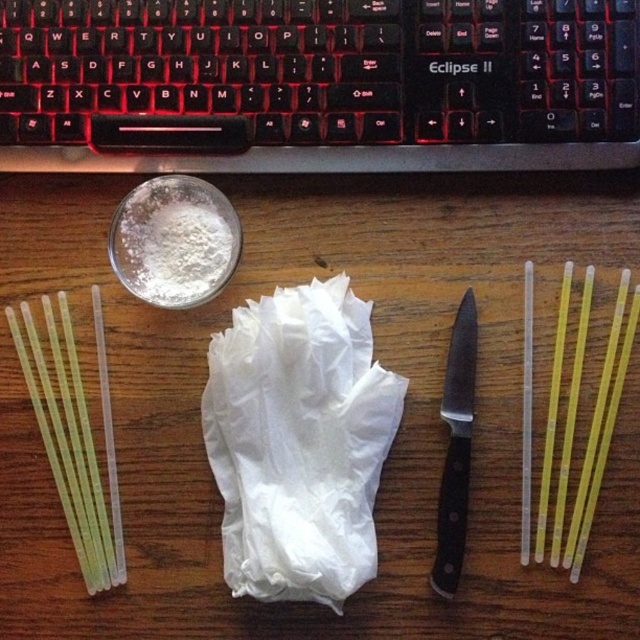
Is wooden table at center shorter than black plastic knife at center?

No.

Who is lower down, wooden table at center or black plastic knife at center?

Positioned lower is black plastic knife at center.

Who is more distant from viewer, (458, 276) or (449, 387)?

The point (458, 276) is behind.

The width and height of the screenshot is (640, 640). In order to click on wooden table at center in this screenshot , I will do `click(374, 356)`.

Does black plastic knife at center have a smaller size compared to yellow translucent straw at right?

No, black plastic knife at center is not smaller than yellow translucent straw at right.

Locate an element on the screen. black plastic knife at center is located at coordinates (456, 449).

The image size is (640, 640). Describe the element at coordinates (456, 449) in the screenshot. I see `black plastic knife at center` at that location.

Locate an element on the screen. Image resolution: width=640 pixels, height=640 pixels. black plastic knife at center is located at coordinates pyautogui.click(x=456, y=449).

From the picture: Can you confirm if wooden table at center is bigger than translucent plastic straw at right?

Indeed, wooden table at center has a larger size compared to translucent plastic straw at right.

Measure the distance between point (67, 230) and camera.

Point (67, 230) and camera are 35.39 inches apart.

Locate an element on the screen. wooden table at center is located at coordinates pyautogui.click(x=374, y=356).